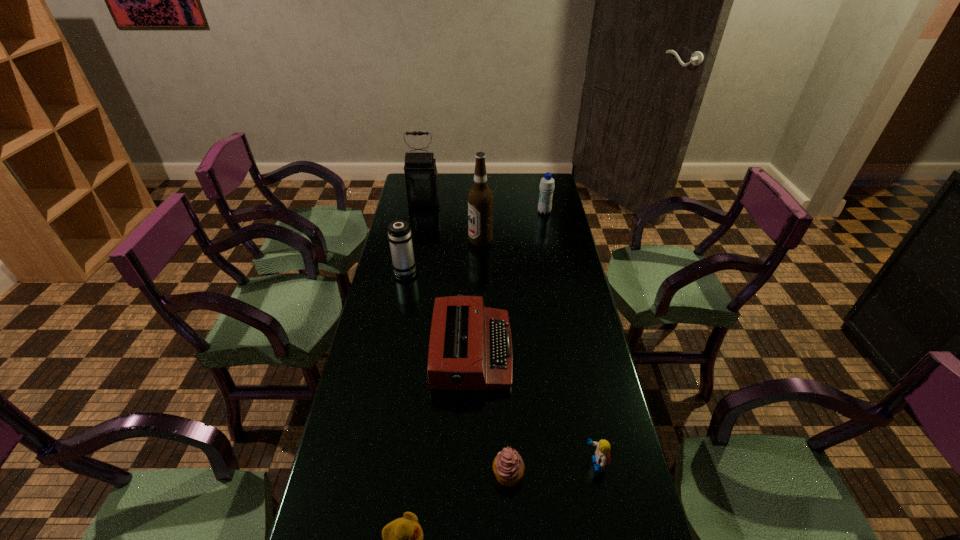
What are the coordinates of `alcohol` in the screenshot? It's located at (480, 197).

Image resolution: width=960 pixels, height=540 pixels. Identify the location of the seventh shortest object. (421, 181).

In order to click on lantern in this screenshot , I will do `click(421, 181)`.

Identify the location of thermos bottle. (399, 235).

Locate an element on the screen. This screenshot has height=540, width=960. water bottle is located at coordinates (546, 185).

In order to click on typewriter in this screenshot , I will do `click(470, 348)`.

Identify the location of Lego. (602, 453).

Find the location of a particular element. The width and height of the screenshot is (960, 540). cupcake is located at coordinates (508, 467).

Identify the location of vacant space positioned 0.240m on the label of the sixth nearest object. (411, 241).

Locate an element on the screen. This screenshot has width=960, height=540. free space located 0.160m on the label of the sixth nearest object is located at coordinates (430, 241).